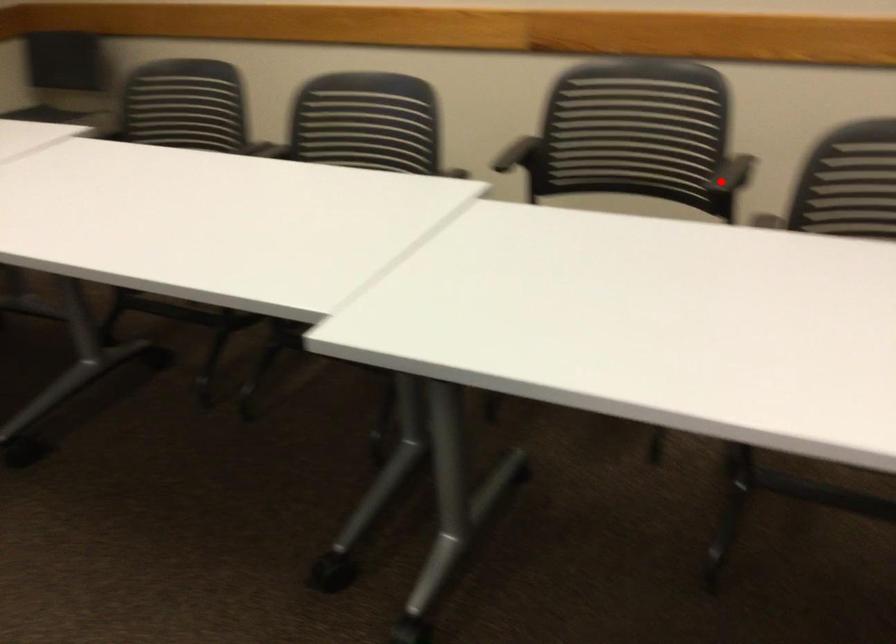
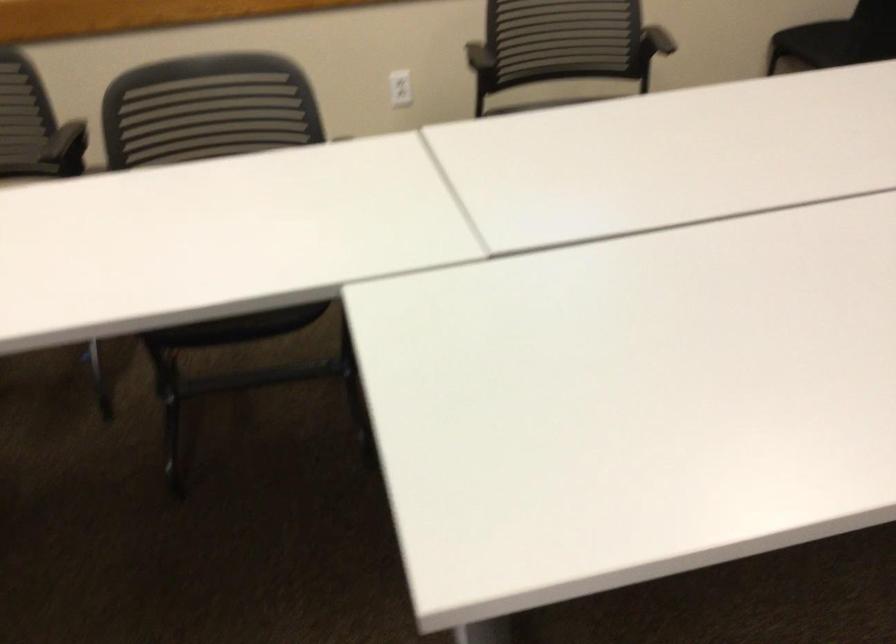
Question: I am providing you with two images of the same scene from different viewpoints. In image1, a red point is highlighted. Considering the same 3D point in image2, which of the following is correct?

Choices:
 (A) It is closer
 (B) It is farther

Answer: (B)